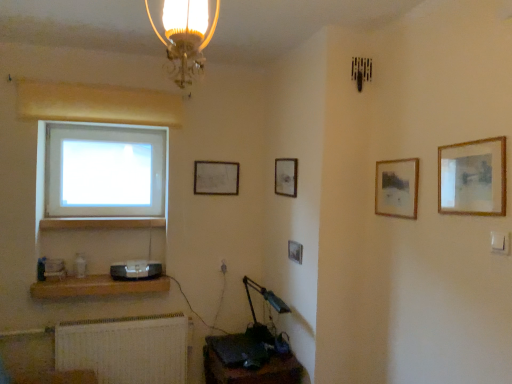
Question: From the image's perspective, is wooden picture frame at upper center, which appears as the 4th picture frame when viewed from the right, positioned above or below wooden frame at upper right, which is the fifth picture frame from left to right?

Choices:
 (A) below
 (B) above

Answer: (B)

Question: From a real-world perspective, is wooden picture frame at upper center, the 4th picture frame viewed from the front, physically located above or below wooden frame at upper right, arranged as the 1th picture frame when viewed from the right?

Choices:
 (A) above
 (B) below

Answer: (A)

Question: Considering the real-world distances, which object is closest to the wooden frame at upper right, the first picture frame viewed from the front?

Choices:
 (A) wooden picture frame at center, which ranks as the third picture frame in left-to-right order
 (B) wooden at lower left
 (C) wooden picture frame at upper center, which appears as the 4th picture frame when viewed from the right
 (D) wooden framed picture at upper right, the 2th picture frame viewed from the front
 (E) metallic blue table lamp at lower center

Answer: (D)

Question: Based on their relative distances, which object is farther from the transparent glass window at left?

Choices:
 (A) wooden frame at upper right, arranged as the 1th picture frame when viewed from the right
 (B) gold glass chandelier at upper center
 (C) matte silver picture frame at upper center, acting as the fifth picture frame starting from the front
 (D) white textured radiator at lower left
 (E) satin black speaker at lower left

Answer: (A)